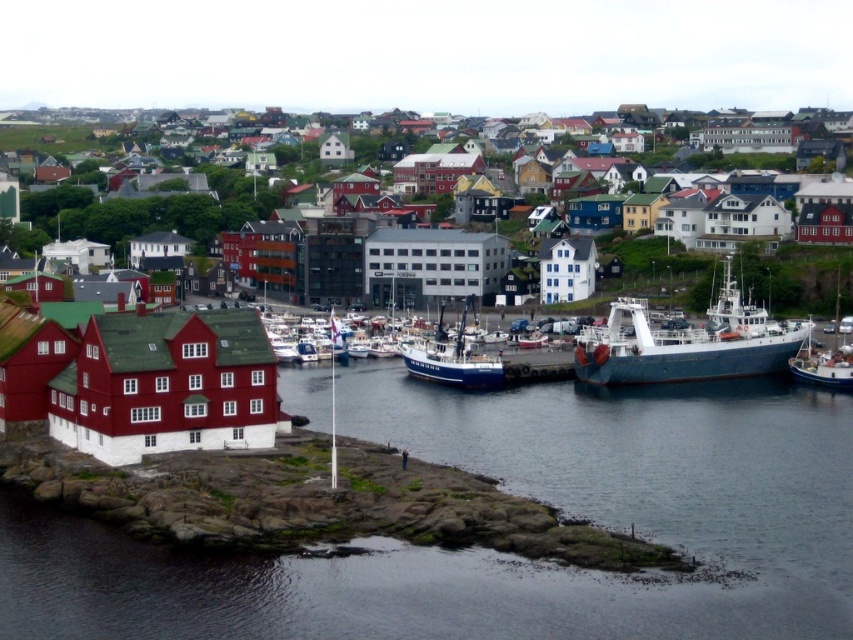
You are standing at the point with coordinates (799, 284) in the coastal town scene. What object is exactly at your current location?

The matte red building at center is exactly at the point (799, 284).

You are a harbor inspector checking the docking space. The blue metallic ship at lower right and the blue metallic boat at right are both arriving. Which one requires a wider berth for safe docking?

The blue metallic ship at lower right requires a wider berth for safe docking because its width surpasses that of the blue metallic boat at right.

You are standing at the viewpoint overlooking the coastal town. There are two points marked in the scene, one at coordinate point (677, 369) and another at point (836, 342). Which of these two points is physically closer to your current position?

Point (677, 369) is closer to the camera than point (836, 342), so the point at coordinate point (677, 369) is physically closer to your current position.